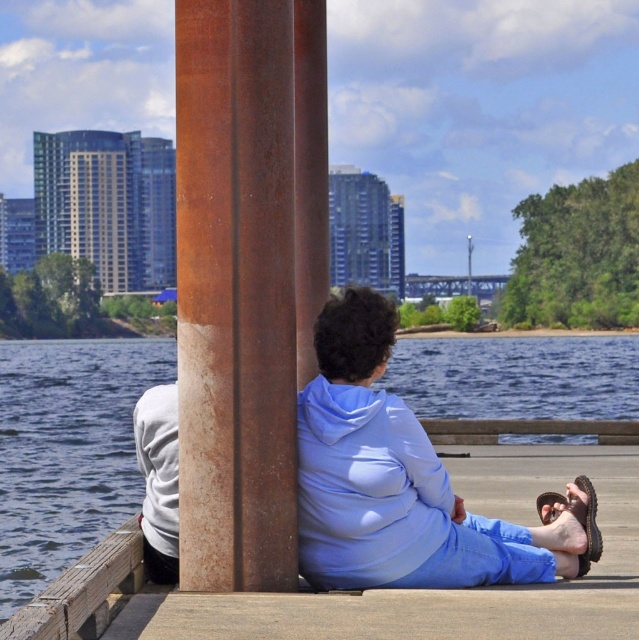
Question: Considering the relative positions of light blue hoodie at center and white matte hoodie at lower left in the image provided, where is light blue hoodie at center located with respect to white matte hoodie at lower left?

Choices:
 (A) left
 (B) right

Answer: (B)

Question: Can you confirm if blue water at center is positioned above white matte hoodie at lower left?

Choices:
 (A) no
 (B) yes

Answer: (A)

Question: Is rusty metal pole at left to the right of white matte hoodie at lower left from the viewer's perspective?

Choices:
 (A) no
 (B) yes

Answer: (B)

Question: Which point is farther to the camera?

Choices:
 (A) (289, 490)
 (B) (626, 378)

Answer: (B)

Question: Which object appears farthest from the camera in this image?

Choices:
 (A) white matte hoodie at lower left
 (B) blue water at center
 (C) light blue hoodie at center

Answer: (B)

Question: Which is nearer to the rusty metal pole at left?

Choices:
 (A) white matte hoodie at lower left
 (B) blue water at center
 (C) light blue hoodie at center

Answer: (C)